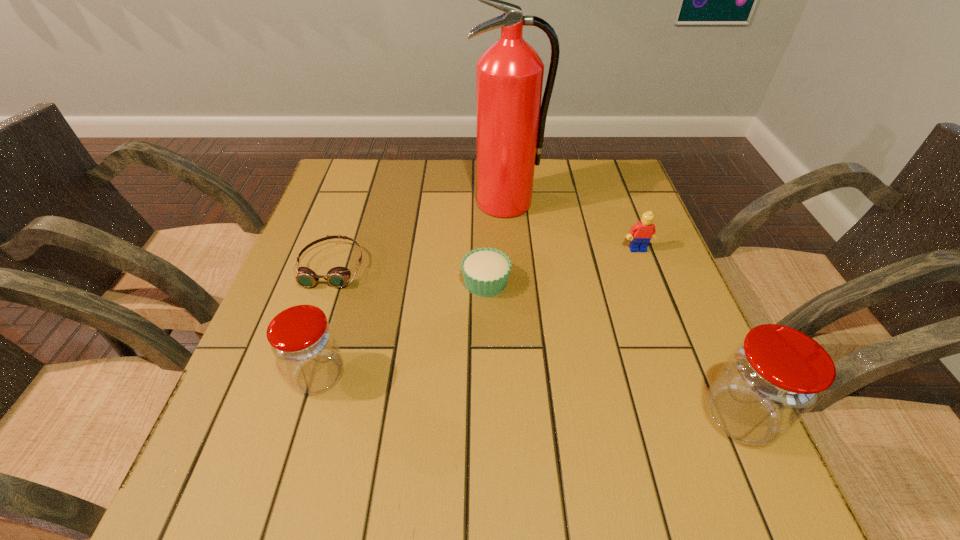
The image size is (960, 540). What are the coordinates of `the fourth shortest object` in the screenshot? It's located at (302, 340).

I want to click on the shorter jar, so click(x=302, y=340).

At what (x,y) coordinates should I click in order to perform the action: click on the fifth shortest object. Please return your answer as a coordinate pair (x, y). Image resolution: width=960 pixels, height=540 pixels. Looking at the image, I should click on (772, 379).

Where is `the right jar`? The width and height of the screenshot is (960, 540). the right jar is located at coordinates (772, 379).

You are a GUI agent. You are given a task and a screenshot of the screen. Output one action in this format:
    pyautogui.click(x=<x>, y=<y>)
    Task: Click on the tallest object
    
    Given the screenshot: What is the action you would take?
    pyautogui.click(x=510, y=119)

The width and height of the screenshot is (960, 540). Identify the location of fire extinguisher. (510, 119).

Where is `Lego`? Lego is located at coordinates (644, 230).

Where is `the shortest object`? the shortest object is located at coordinates (337, 277).

Locate an element on the screen. This screenshot has width=960, height=540. the second shortest object is located at coordinates (485, 271).

The image size is (960, 540). In order to click on vacant space located 0.390m on the back of the left jar in this screenshot , I will do `click(363, 228)`.